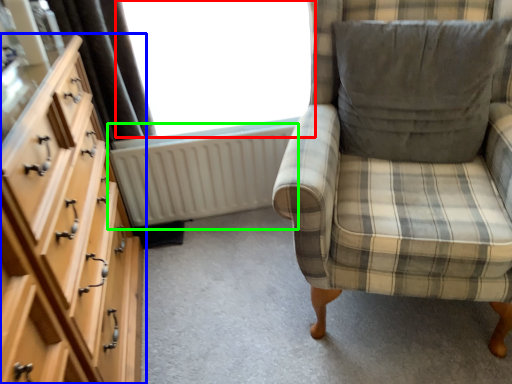
Question: Which object is the closest to the window (highlighted by a red box)? Choose among these: chest of drawers (highlighted by a blue box) or radiator (highlighted by a green box).

Choices:
 (A) chest of drawers
 (B) radiator

Answer: (B)